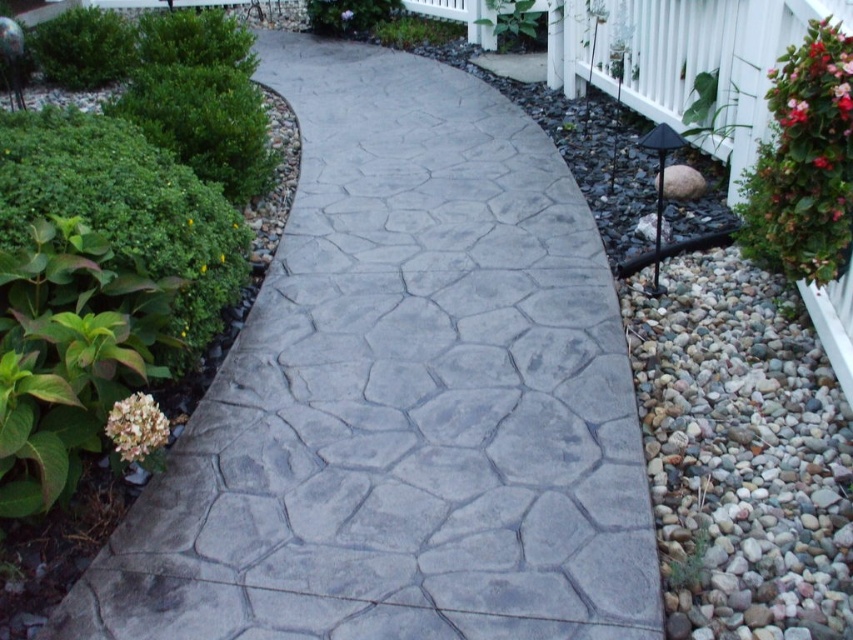
Question: Among these objects, which one is nearest to the camera?

Choices:
 (A) red matte flower at upper right
 (B) white matte flower at center

Answer: (A)

Question: Is gray stone pathway at center to the right of red matte flower at upper right from the viewer's perspective?

Choices:
 (A) yes
 (B) no

Answer: (B)

Question: Based on their relative distances, which object is farther from the red matte flower at upper right?

Choices:
 (A) green leafy bush at upper left
 (B) white matte flower at center
 (C) green leafy bush at upper right
 (D) red glossy flower at upper right

Answer: (B)

Question: Does gray stone pathway at center appear over green leafy bush at upper right?

Choices:
 (A) no
 (B) yes

Answer: (A)

Question: Which of these objects is positioned farthest from the green leafy bush at upper right?

Choices:
 (A) white matte flower at center
 (B) red matte flower at upper right
 (C) green leafy plant at upper center
 (D) red glossy flower at upper right

Answer: (A)

Question: Where is green leafy bush at upper left located in relation to red glossy flower at upper right in the image?

Choices:
 (A) left
 (B) right

Answer: (A)